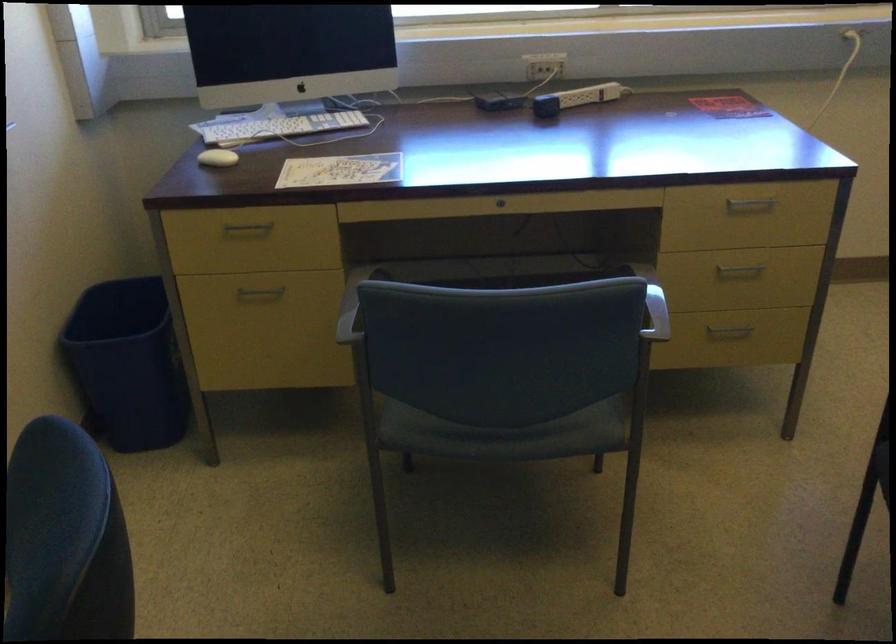
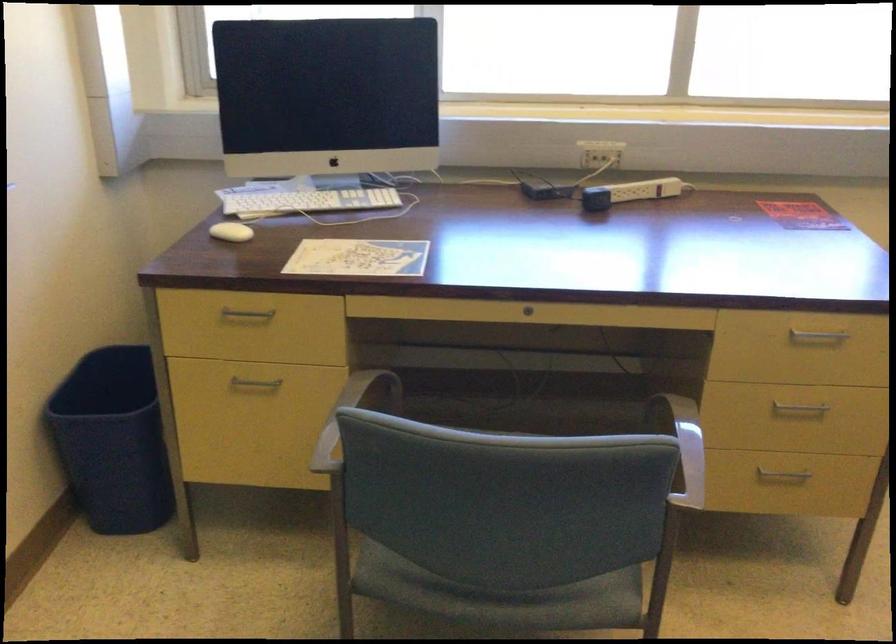
Question: The images are taken continuously from a first-person perspective. In which direction is your viewpoint rotating?

Choices:
 (A) Left
 (B) Right
 (C) Up
 (D) Down

Answer: (A)